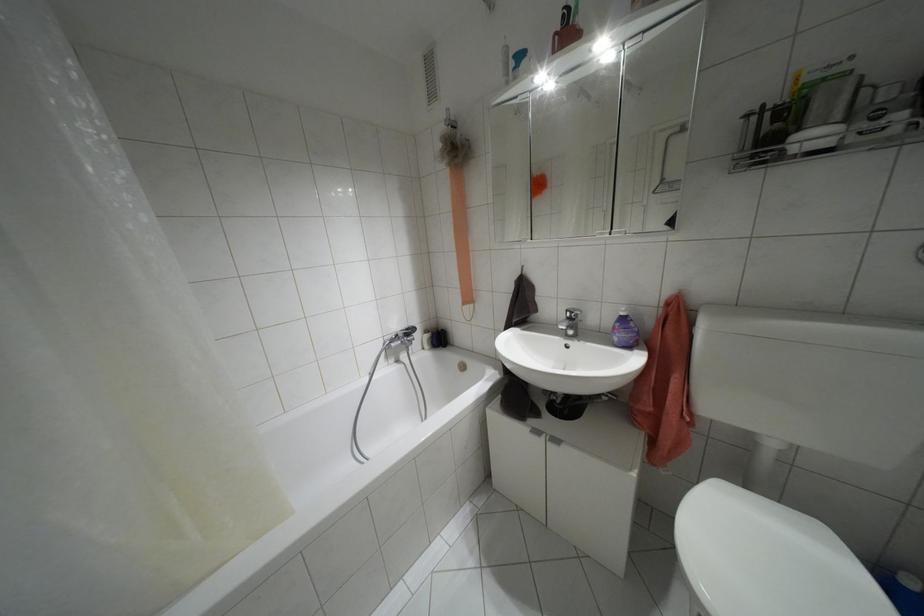
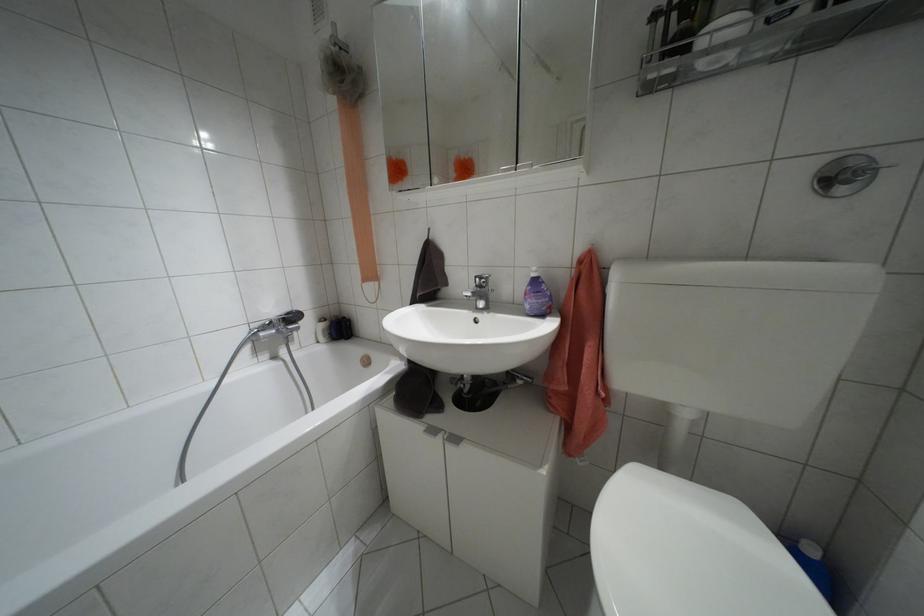
The point at (555, 440) is marked in the first image. Where is the corresponding point in the second image?

(455, 439)